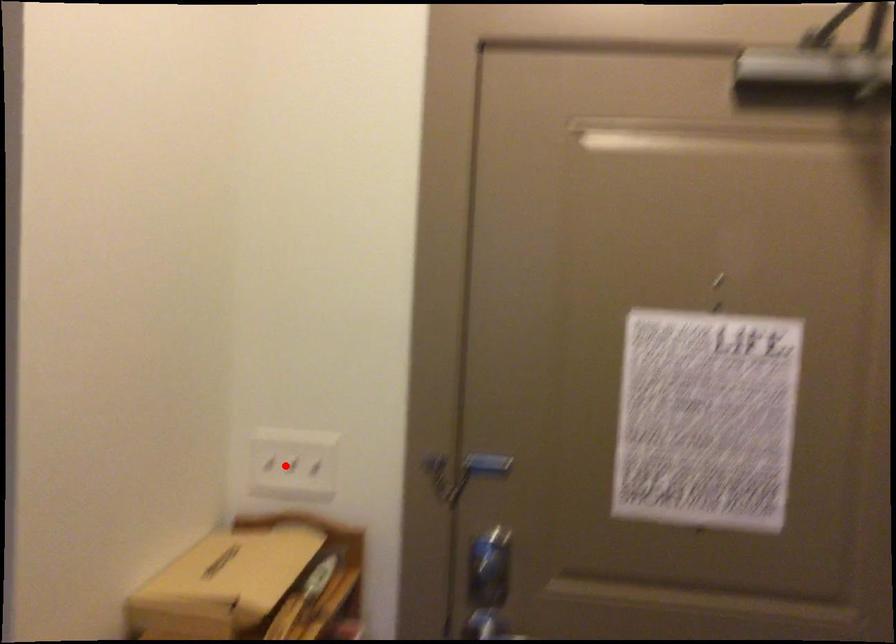
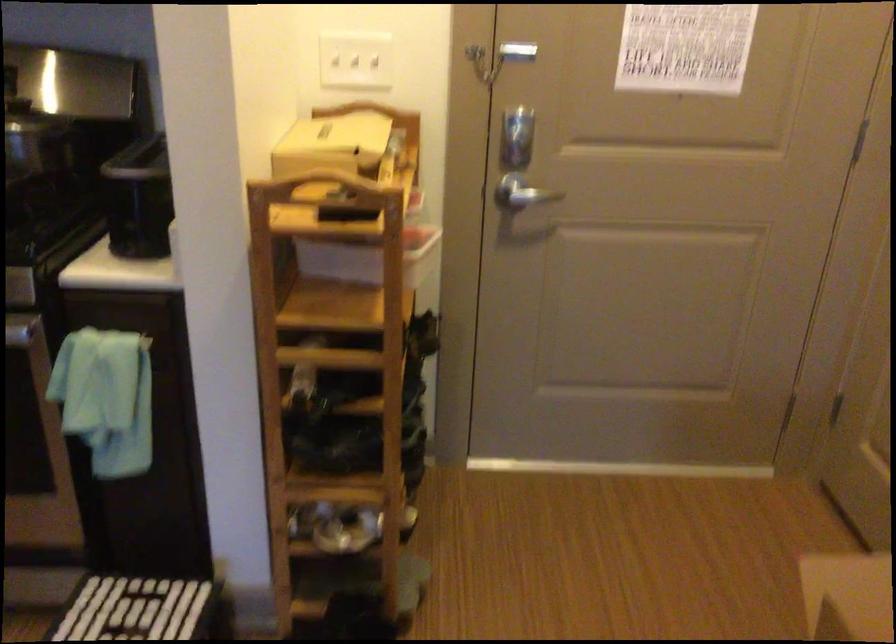
Question: A red point is marked in image1. In image2, is the corresponding 3D point closer to the camera or farther? Reply with the corresponding letter.

Choices:
 (A) The corresponding 3D point is closer.
 (B) The corresponding 3D point is farther.

Answer: (B)